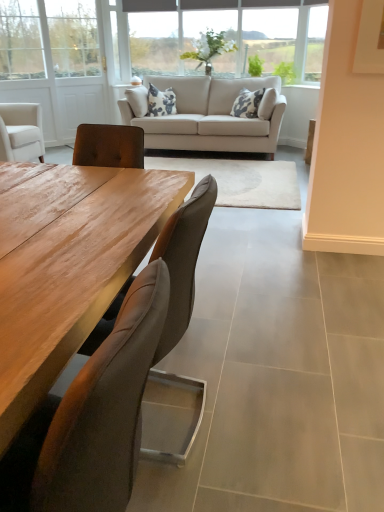
Question: Is point (198, 54) positioned closer to the camera than point (157, 345)?

Choices:
 (A) farther
 (B) closer

Answer: (A)

Question: From a real-world perspective, is clear glass vase at upper center, the 2th window when ordered from left to right, physically located above or below brown leather chair at center, the first chair positioned from the back?

Choices:
 (A) below
 (B) above

Answer: (B)

Question: Which object is positioned closest to the beige fabric couch at center?

Choices:
 (A) brown leather chair at center, the first chair positioned from the back
 (B) clear glass window at upper center, which appears as the 2th window when viewed from the right
 (C) leather cushioned chair at center, the 2th chair when ordered from back to front
 (D) white wood screen door at upper left
 (E) clear glass vase at upper center, the 2th window when ordered from left to right

Answer: (E)

Question: Estimate the real-world distances between objects in this image. Which object is farther from the clear glass window at upper center, which appears as the 2th window when viewed from the right?

Choices:
 (A) white wood screen door at upper left
 (B) leather cushioned chair at center, the 1th chair positioned from the front
 (C) brown leather chair at center, the first chair positioned from the back
 (D) clear glass vase at upper center, the 2th window when ordered from left to right
 (E) beige fabric couch at center

Answer: (B)